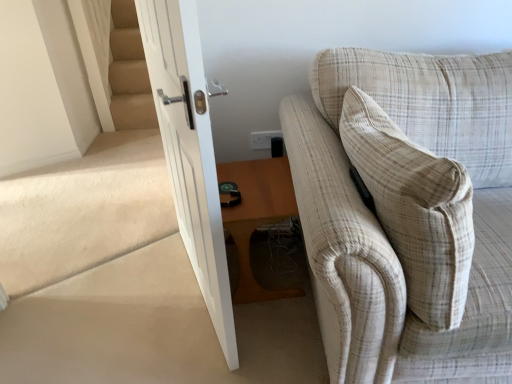
Question: Is white plastic electric outlet at upper center thinner than white glossy door at center?

Choices:
 (A) yes
 (B) no

Answer: (A)

Question: Is white plastic electric outlet at upper center aimed at white glossy door at center?

Choices:
 (A) yes
 (B) no

Answer: (B)

Question: From the image's perspective, is white plastic electric outlet at upper center above white glossy door at center?

Choices:
 (A) no
 (B) yes

Answer: (B)

Question: Is white glossy door at center at the back of white plastic electric outlet at upper center?

Choices:
 (A) yes
 (B) no

Answer: (B)

Question: Considering the relative sizes of white plastic electric outlet at upper center and white glossy door at center in the image provided, is white plastic electric outlet at upper center bigger than white glossy door at center?

Choices:
 (A) yes
 (B) no

Answer: (B)

Question: From the image's perspective, is beige plaid pillow at right positioned above or below white glossy door at center?

Choices:
 (A) above
 (B) below

Answer: (B)

Question: Does point tap(448, 225) appear closer or farther from the camera than point tap(202, 107)?

Choices:
 (A) farther
 (B) closer

Answer: (A)

Question: Looking at the image, does beige plaid pillow at right seem bigger or smaller compared to white glossy door at center?

Choices:
 (A) small
 (B) big

Answer: (A)

Question: Do you think beige plaid pillow at right is within white glossy door at center, or outside of it?

Choices:
 (A) outside
 (B) inside

Answer: (A)

Question: In terms of size, does beige plaid fabric couch at right appear bigger or smaller than white glossy door at center?

Choices:
 (A) small
 (B) big

Answer: (B)

Question: Is beige plaid fabric couch at right taller or shorter than white glossy door at center?

Choices:
 (A) short
 (B) tall

Answer: (A)

Question: Relative to white glossy door at center, is beige plaid fabric couch at right in front or behind?

Choices:
 (A) front
 (B) behind

Answer: (A)

Question: From the image's perspective, is beige plaid fabric couch at right positioned above or below white glossy door at center?

Choices:
 (A) above
 (B) below

Answer: (B)

Question: Is point (276, 130) closer or farther from the camera than point (415, 94)?

Choices:
 (A) farther
 (B) closer

Answer: (A)

Question: In terms of width, does white plastic electric outlet at upper center look wider or thinner when compared to beige plaid fabric couch at right?

Choices:
 (A) wide
 (B) thin

Answer: (B)